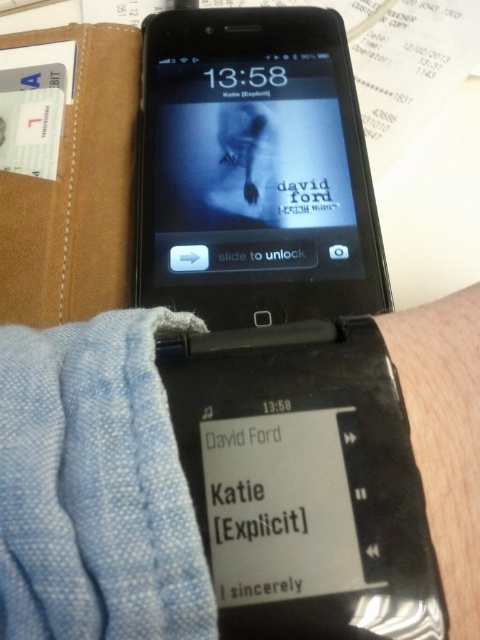
Question: Which point is farther to the camera?

Choices:
 (A) (468, 400)
 (B) (262, 260)

Answer: (B)

Question: Does black glossy smartphone at center have a larger size compared to skinny silver bracelet at lower right?

Choices:
 (A) no
 (B) yes

Answer: (B)

Question: Is black glossy smartphone at center to the right of skinny silver bracelet at lower right from the viewer's perspective?

Choices:
 (A) yes
 (B) no

Answer: (B)

Question: Which of the following is the farthest from the observer?

Choices:
 (A) black glossy smartphone at center
 (B) skinny silver bracelet at lower right

Answer: (A)

Question: Considering the relative positions of black glossy smartphone at center and skinny silver bracelet at lower right in the image provided, where is black glossy smartphone at center located with respect to skinny silver bracelet at lower right?

Choices:
 (A) right
 (B) left

Answer: (B)